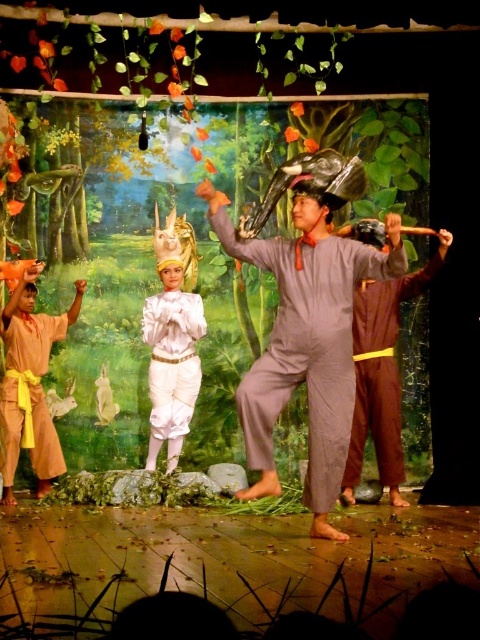
Based on the photo, does matte brown robe at left have a lesser width compared to white satin costume at center?

Yes.

Is point (48, 436) positioned behind point (160, 412)?

No, (48, 436) is in front of (160, 412).

Is point (45, 339) less distant than point (197, 323)?

Yes, point (45, 339) is closer to viewer.

Locate an element on the screen. matte brown robe at left is located at coordinates (28, 394).

Is brown cotton pants at center closer to the viewer compared to matte brown robe at left?

That is True.

Is point (384, 330) farther from viewer compared to point (0, 429)?

Yes, point (384, 330) is behind point (0, 429).

You are a GUI agent. You are given a task and a screenshot of the screen. Output one action in this format:
    pyautogui.click(x=<x>, y=<y>)
    Task: Click on the brown cotton pants at center
    The height and width of the screenshot is (640, 480).
    Given the screenshot: What is the action you would take?
    pyautogui.click(x=381, y=372)

Which of these two, brown cotton pants at center or white satin costume at center, stands taller?

brown cotton pants at center is taller.

Find the location of a particular element. The height and width of the screenshot is (640, 480). brown cotton pants at center is located at coordinates (381, 372).

Is point (400, 285) positioned before point (180, 349)?

Yes, it is in front of point (180, 349).

You are a GUI agent. You are given a task and a screenshot of the screen. Output one action in this format:
    pyautogui.click(x=<x>, y=<y>)
    Task: Click on the brown cotton pants at center
    
    Given the screenshot: What is the action you would take?
    pyautogui.click(x=381, y=372)